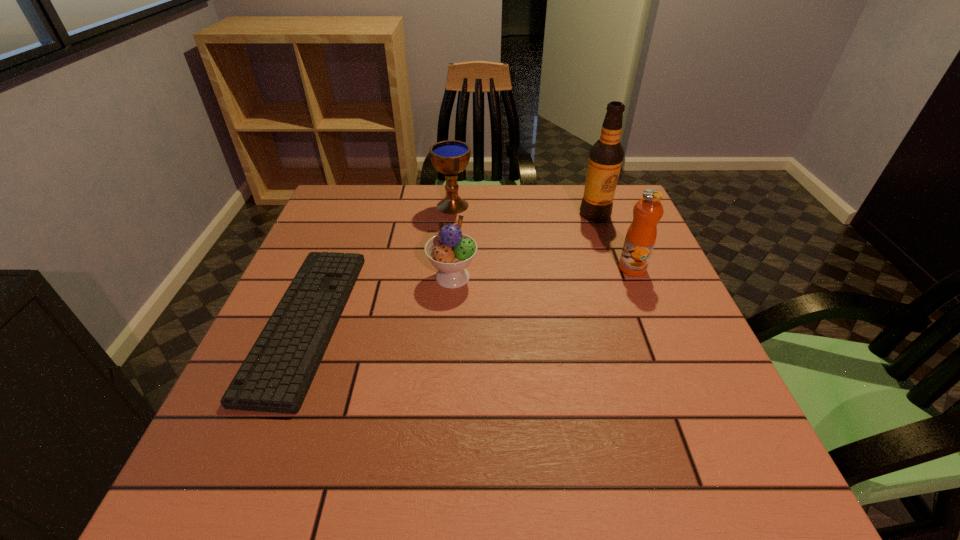
Find the location of a particular element. The height and width of the screenshot is (540, 960). object that is the second closest one to the chalice is located at coordinates (277, 373).

You are a GUI agent. You are given a task and a screenshot of the screen. Output one action in this format:
    pyautogui.click(x=<x>, y=<y>)
    Task: Click on the object that stands as the fourth closest to the leftmost object
    The image size is (960, 540).
    Given the screenshot: What is the action you would take?
    pyautogui.click(x=641, y=235)

The image size is (960, 540). Find the location of `blank space that satisfies the following two spatial constraints: 1. on the label of the alcohol; 2. on the left side of the fruit juice`. blank space that satisfies the following two spatial constraints: 1. on the label of the alcohol; 2. on the left side of the fruit juice is located at coordinates (614, 268).